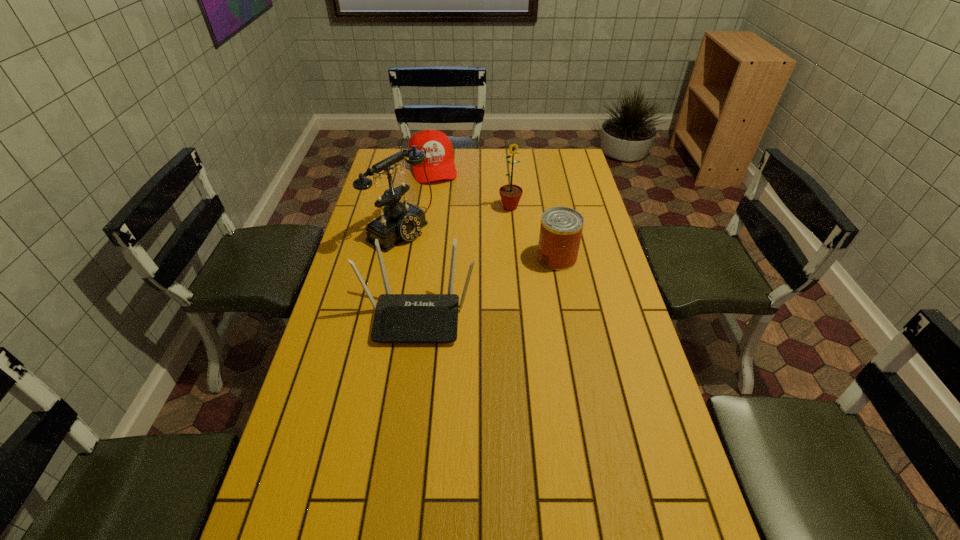
Find the location of `free space that satisfies the following two spatial constraints: 1. on the front side of the baseball cap; 2. on the left side of the sunflower`. free space that satisfies the following two spatial constraints: 1. on the front side of the baseball cap; 2. on the left side of the sunflower is located at coordinates (427, 207).

Locate an element on the screen. The width and height of the screenshot is (960, 540). free spot that satisfies the following two spatial constraints: 1. on the back side of the sunflower; 2. on the left side of the telephone is located at coordinates (404, 207).

This screenshot has width=960, height=540. I want to click on free location that satisfies the following two spatial constraints: 1. on the back side of the telephone; 2. on the right side of the farthest object, so click(x=413, y=167).